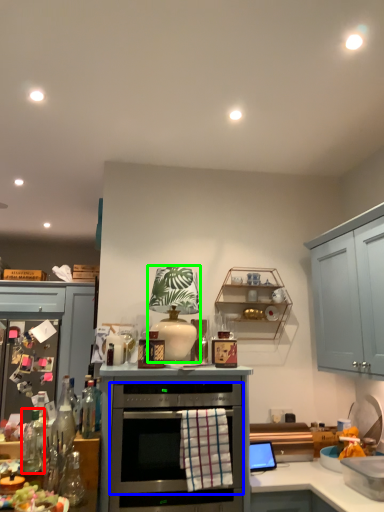
Question: Estimate the real-world distances between objects in this image. Which object is farther from bottle (highlighted by a red box), oven (highlighted by a blue box) or appliance (highlighted by a green box)?

Choices:
 (A) oven
 (B) appliance

Answer: (B)